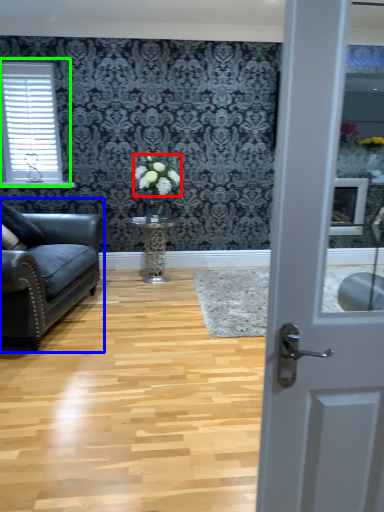
Question: Which object is the closest to the flower (highlighted by a red box)? Choose among these: studio couch (highlighted by a blue box) or window (highlighted by a green box).

Choices:
 (A) studio couch
 (B) window

Answer: (A)